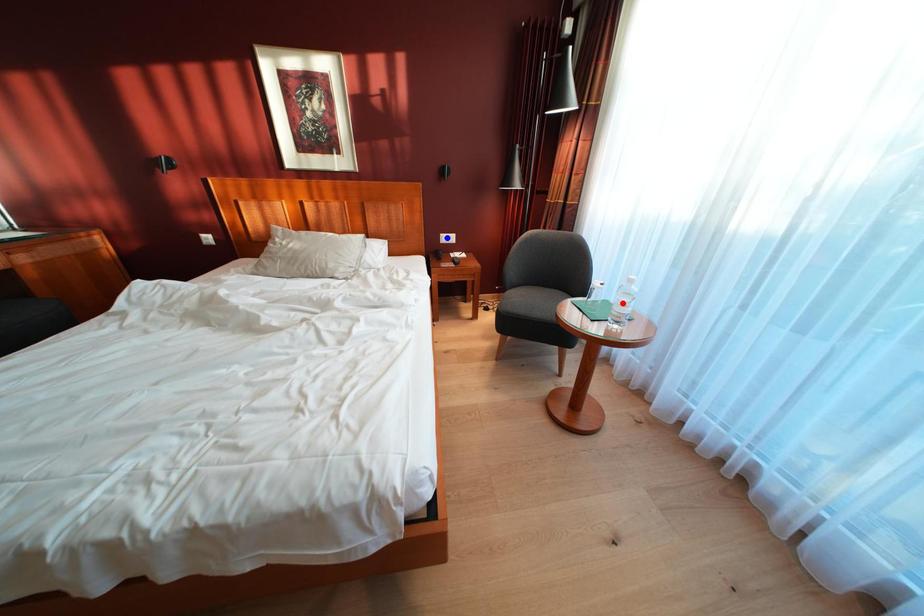
Question: In the image, two points are highlighted. Which point is nearer to the camera? Reply with the corresponding letter.

Choices:
 (A) blue point
 (B) red point

Answer: (B)